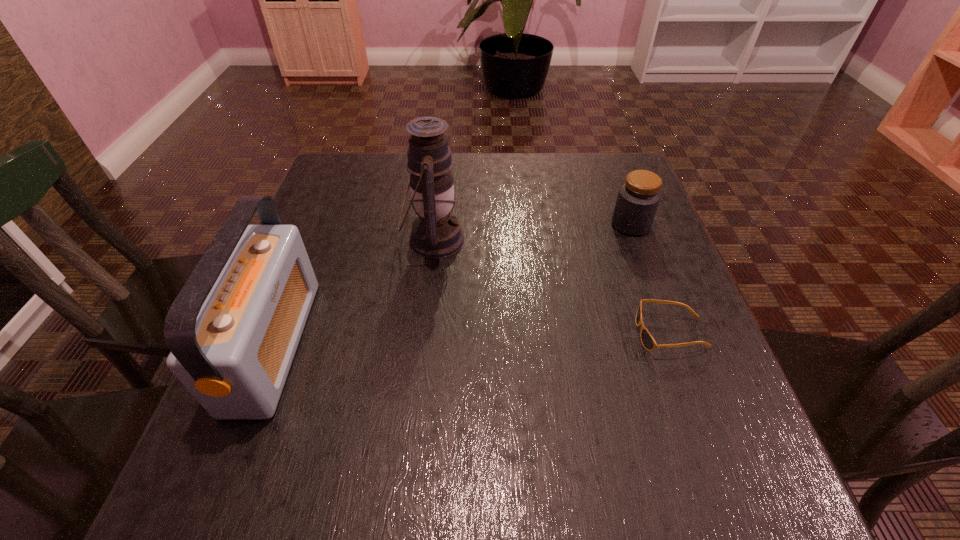
Locate an element on the screen. oil lamp is located at coordinates (436, 233).

This screenshot has width=960, height=540. Find the location of `the tallest object`. the tallest object is located at coordinates (436, 233).

The image size is (960, 540). I want to click on the leftmost object, so click(233, 330).

This screenshot has width=960, height=540. Identify the location of radio receiver. (233, 330).

I want to click on jar, so click(638, 198).

What are the coordinates of `the shortest object` in the screenshot? It's located at (648, 342).

The height and width of the screenshot is (540, 960). Identify the location of vacant space positioned 0.220m on the right of the second object from left to right. (562, 240).

This screenshot has width=960, height=540. I want to click on vacant area situated on the front-facing side of the leftmost object, so click(356, 345).

The height and width of the screenshot is (540, 960). Identify the location of vacant space situated on the surface of the jar near the warning symbol. (648, 272).

What are the coordinates of `vacant space situated 0.220m on the front-facing side of the shortest object` in the screenshot? It's located at (518, 334).